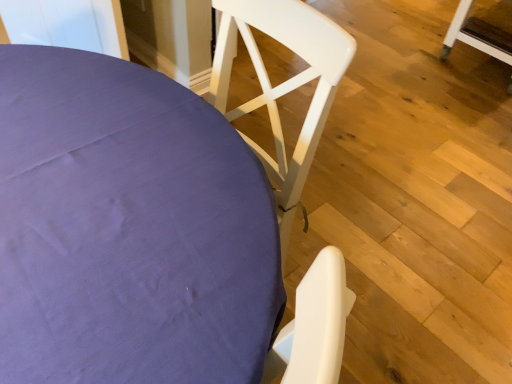
Image resolution: width=512 pixels, height=384 pixels. What do you see at coordinates (128, 229) in the screenshot?
I see `white wood chair at upper center, which is the first chair from front to back` at bounding box center [128, 229].

Identify the location of white wood chair at upper center, the 2th chair from the back. (128, 229).

Identify the location of white wood chair at upper right, positioned as the 2th chair in front-to-back order. (477, 35).

Describe the element at coordinates (477, 35) in the screenshot. I see `white wood chair at upper right, the first chair positioned from the right` at that location.

Locate an element on the screen. white wood chair at upper center, which appears as the 2th chair when viewed from the right is located at coordinates (128, 229).

Which is more to the right, white wood chair at upper right, which is the first chair from back to front, or white wood chair at upper center, which appears as the 2th chair when viewed from the right?

white wood chair at upper right, which is the first chair from back to front.

Considering their positions, is white wood chair at upper right, positioned as the 2th chair in front-to-back order, located in front of or behind white wood chair at upper center, the second chair when ordered from top to bottom?

white wood chair at upper right, positioned as the 2th chair in front-to-back order, is positioned farther from the viewer than white wood chair at upper center, the second chair when ordered from top to bottom.

Which is in front, point (510, 38) or point (266, 295)?

The point (266, 295) is in front.

From the image's perspective, which is above, white wood chair at upper right, which is the first chair from back to front, or white wood chair at upper center, the second chair when ordered from top to bottom?

white wood chair at upper right, which is the first chair from back to front.

Based on the photo, from a real-world perspective, is white wood chair at upper right, the 2th chair in the bottom-to-top sequence, below white wood chair at upper center, the 1th chair when ordered from bottom to top?

Yes.

Considering the sizes of white wood chair at upper right, the 2th chair in the bottom-to-top sequence, and white wood chair at upper center, the 2th chair from the back, in the image, is white wood chair at upper right, the 2th chair in the bottom-to-top sequence, wider or thinner than white wood chair at upper center, the 2th chair from the back,?

Considering their sizes, white wood chair at upper right, the 2th chair in the bottom-to-top sequence, looks slimmer than white wood chair at upper center, the 2th chair from the back.

Considering the relative sizes of white wood chair at upper right, the first chair positioned from the right, and white wood chair at upper center, the second chair when ordered from top to bottom, in the image provided, is white wood chair at upper right, the first chair positioned from the right, taller than white wood chair at upper center, the second chair when ordered from top to bottom,?

Incorrect, the height of white wood chair at upper right, the first chair positioned from the right, is not larger of that of white wood chair at upper center, the second chair when ordered from top to bottom.

Is white wood chair at upper right, positioned as the 2th chair in front-to-back order, smaller than white wood chair at upper center, the 1th chair positioned from the left?

Indeed, white wood chair at upper right, positioned as the 2th chair in front-to-back order, has a smaller size compared to white wood chair at upper center, the 1th chair positioned from the left.

In the scene shown: Is white wood chair at upper right, placed as the second chair when sorted from left to right, located outside white wood chair at upper center, the second chair when ordered from top to bottom?

Yes, white wood chair at upper right, placed as the second chair when sorted from left to right, is located beyond the bounds of white wood chair at upper center, the second chair when ordered from top to bottom.

Is white wood chair at upper right, the 2th chair in the bottom-to-top sequence, positioned far away from white wood chair at upper center, which is the first chair from front to back?

Yes, white wood chair at upper right, the 2th chair in the bottom-to-top sequence, and white wood chair at upper center, which is the first chair from front to back, are located far from each other.

Could you tell me if white wood chair at upper right, which is the first chair from back to front, is facing white wood chair at upper center, which is the first chair from front to back?

No, white wood chair at upper right, which is the first chair from back to front, is not facing towards white wood chair at upper center, which is the first chair from front to back.

How different are the orientations of white wood chair at upper right, placed as the second chair when sorted from left to right, and white wood chair at upper center, the second chair when ordered from top to bottom, in degrees?

The facing directions of white wood chair at upper right, placed as the second chair when sorted from left to right, and white wood chair at upper center, the second chair when ordered from top to bottom, are 96 degrees apart.

You are a GUI agent. You are given a task and a screenshot of the screen. Output one action in this format:
    pyautogui.click(x=<x>, y=<y>)
    Task: Click on the chair that appears behind the white wood chair at upper center, the 1th chair when ordered from bottom to top
    
    Given the screenshot: What is the action you would take?
    pyautogui.click(x=477, y=35)

Between white wood chair at upper center, which is the first chair from front to back, and white wood chair at upper right, positioned as the 2th chair in front-to-back order, which one appears on the right side from the viewer's perspective?

From the viewer's perspective, white wood chair at upper right, positioned as the 2th chair in front-to-back order, appears more on the right side.

Is white wood chair at upper center, the 2th chair from the back, closer to the viewer compared to white wood chair at upper right, placed as the second chair when sorted from left to right?

That is True.

Is point (70, 62) farther from viewer compared to point (460, 22)?

No, (70, 62) is in front of (460, 22).

From the image's perspective, is white wood chair at upper center, the second chair when ordered from top to bottom, below white wood chair at upper right, positioned as the 2th chair in front-to-back order?

Yes, from the image's perspective, white wood chair at upper center, the second chair when ordered from top to bottom, is below white wood chair at upper right, positioned as the 2th chair in front-to-back order.

From a real-world perspective, does white wood chair at upper center, the 1th chair when ordered from bottom to top, sit lower than white wood chair at upper right, arranged as the 1th chair when viewed from the top?

Actually, white wood chair at upper center, the 1th chair when ordered from bottom to top, is physically above white wood chair at upper right, arranged as the 1th chair when viewed from the top, in the real world.

Which object is thinner, white wood chair at upper center, the 1th chair when ordered from bottom to top, or white wood chair at upper right, which is the first chair from back to front?

Thinner between the two is white wood chair at upper right, which is the first chair from back to front.

From the picture: Who is taller, white wood chair at upper center, the 2th chair from the back, or white wood chair at upper right, the first chair positioned from the right?

white wood chair at upper center, the 2th chair from the back.

Is white wood chair at upper center, the 1th chair positioned from the left, bigger or smaller than white wood chair at upper right, positioned as the 2th chair in front-to-back order?

white wood chair at upper center, the 1th chair positioned from the left, is bigger than white wood chair at upper right, positioned as the 2th chair in front-to-back order.

Do you think white wood chair at upper center, which is the first chair from front to back, is within white wood chair at upper right, the 2th chair in the bottom-to-top sequence, or outside of it?

The correct answer is: outside.

Consider the image. Is white wood chair at upper center, which is the first chair from front to back, positioned far away from white wood chair at upper right, positioned as the 2th chair in front-to-back order?

white wood chair at upper center, which is the first chair from front to back, is positioned a significant distance from white wood chair at upper right, positioned as the 2th chair in front-to-back order.

Is white wood chair at upper center, the 1th chair positioned from the left, facing towards white wood chair at upper right, the first chair positioned from the right?

No, white wood chair at upper center, the 1th chair positioned from the left, is not turned towards white wood chair at upper right, the first chair positioned from the right.

How many degrees apart are the facing directions of white wood chair at upper center, the second chair when ordered from top to bottom, and white wood chair at upper right, which is the first chair from back to front?

They differ by 96 degrees in their facing directions.

Where is `chair on the right of white wood chair at upper center, the second chair when ordered from top to bottom`? The height and width of the screenshot is (384, 512). chair on the right of white wood chair at upper center, the second chair when ordered from top to bottom is located at coordinates (477, 35).

Identify the location of chair positioned vertically above the white wood chair at upper right, the 2th chair in the bottom-to-top sequence (from a real-world perspective). (128, 229).

Locate an element on the screen. The width and height of the screenshot is (512, 384). chair above the white wood chair at upper center, the 2th chair from the back (from the image's perspective) is located at coordinates (477, 35).